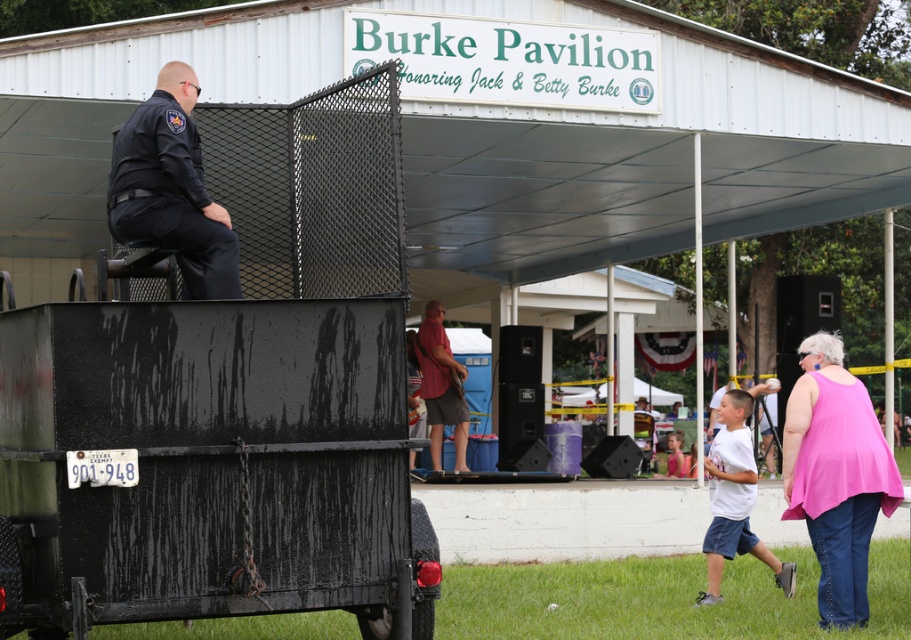
Is pink fabric tank top at lower right wider than dark blue uniform at upper left?

In fact, pink fabric tank top at lower right might be narrower than dark blue uniform at upper left.

Find the location of a particular element. The width and height of the screenshot is (911, 640). pink fabric tank top at lower right is located at coordinates pos(836,476).

Where is `pink fabric tank top at lower right`? The image size is (911, 640). pink fabric tank top at lower right is located at coordinates (836, 476).

Can you confirm if white matte shirt at lower right is positioned below white cotton shirt at center?

Incorrect, white matte shirt at lower right is not positioned below white cotton shirt at center.

Who is lower down, white matte shirt at lower right or white cotton shirt at center?

white cotton shirt at center is below.

Describe the element at coordinates (734, 499) in the screenshot. I see `white matte shirt at lower right` at that location.

This screenshot has height=640, width=911. What are the coordinates of `white matte shirt at lower right` in the screenshot? It's located at (734, 499).

Is point (437, 390) closer to viewer compared to point (744, 540)?

No, (437, 390) is behind (744, 540).

Which is above, red fabric shirt at center or white matte t-shirt at lower right?

red fabric shirt at center is above.

You are a GUI agent. You are given a task and a screenshot of the screen. Output one action in this format:
    pyautogui.click(x=<x>, y=<y>)
    Task: Click on the red fabric shirt at center
    The height and width of the screenshot is (640, 911).
    Given the screenshot: What is the action you would take?
    pyautogui.click(x=441, y=385)